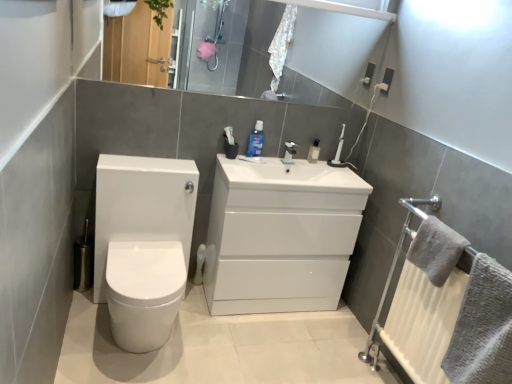
This screenshot has height=384, width=512. Find the location of `vacant space to the left of transparent plastic bottle at upper center, marked as the 2th mouthwash in a left-to-right arrangement`. vacant space to the left of transparent plastic bottle at upper center, marked as the 2th mouthwash in a left-to-right arrangement is located at coordinates (293, 156).